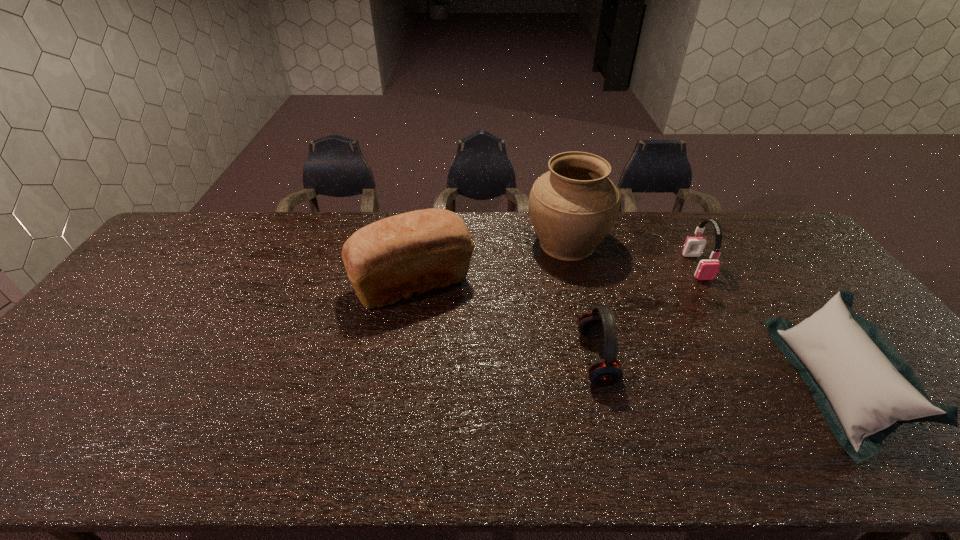
The width and height of the screenshot is (960, 540). What are the coordinates of `vacant space at the far edge of the desktop` in the screenshot? It's located at (266, 221).

The width and height of the screenshot is (960, 540). Identify the location of vacant region at the near edge. (134, 438).

Where is `free point at the left edge`? The width and height of the screenshot is (960, 540). free point at the left edge is located at coordinates (131, 301).

You are a GUI agent. You are given a task and a screenshot of the screen. Output one action in this format:
    pyautogui.click(x=<x>, y=<y>)
    Task: Click on the vacant space at the far right corner of the desktop
    The height and width of the screenshot is (540, 960).
    Given the screenshot: What is the action you would take?
    pyautogui.click(x=767, y=222)

Locate an element on the screen. Image resolution: width=960 pixels, height=540 pixels. vacant point located between the cushion and the urn is located at coordinates (700, 314).

Image resolution: width=960 pixels, height=540 pixels. What are the coordinates of `free point between the cushion and the leftmost object` in the screenshot? It's located at (622, 334).

Where is `free space between the bread and the cushion`? This screenshot has height=540, width=960. free space between the bread and the cushion is located at coordinates 622,334.

Identify the location of free point between the rightmost object and the left earphone. (714, 372).

Locate an element on the screen. The width and height of the screenshot is (960, 540). free spot between the left earphone and the tallest object is located at coordinates (582, 301).

I want to click on free space that is in between the leftmost object and the nearer earphone, so click(x=504, y=321).